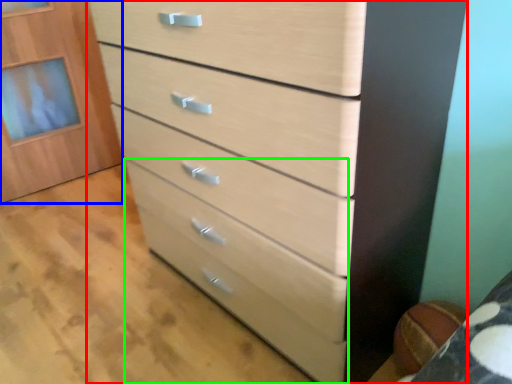
Question: Which object is positioned closest to chest of drawers (highlighted by a red box)? Select from cabinetry (highlighted by a blue box) and drawer (highlighted by a green box).

Choices:
 (A) cabinetry
 (B) drawer

Answer: (B)